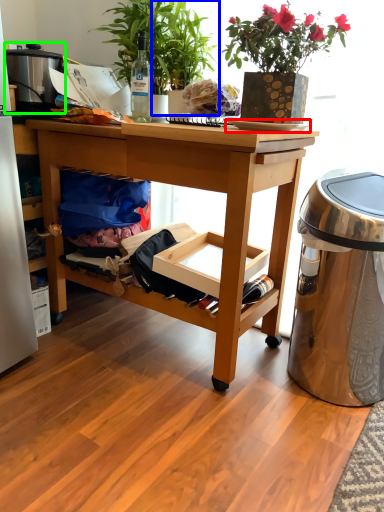
Question: Which object is positioned closest to plate (highlighted by a red box)? Select from houseplant (highlighted by a blue box) and appliance (highlighted by a green box).

Choices:
 (A) houseplant
 (B) appliance

Answer: (A)